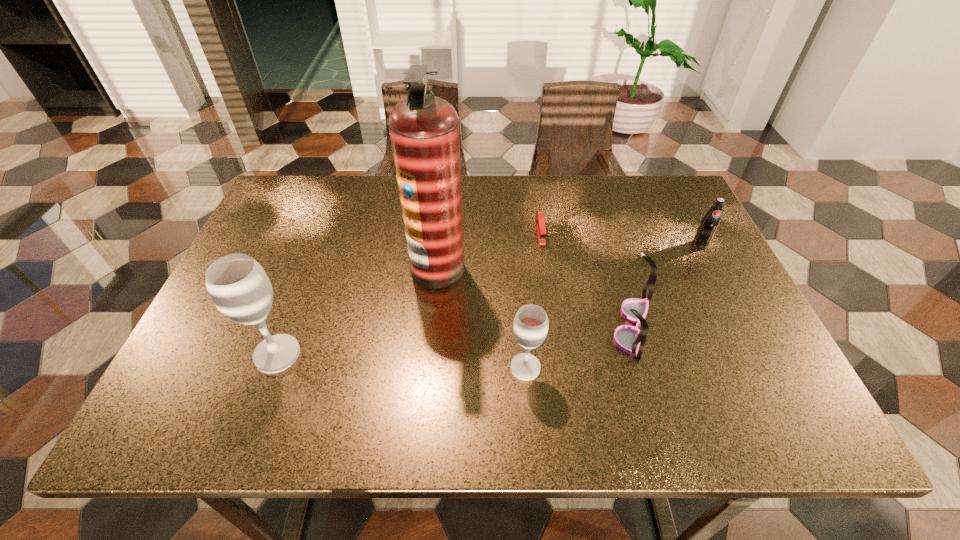
Where is `the taller wineglass`? The height and width of the screenshot is (540, 960). the taller wineglass is located at coordinates (239, 287).

Locate an element on the screen. Image resolution: width=960 pixels, height=540 pixels. the left wineglass is located at coordinates (239, 287).

Identify the location of the fourth object from right to left. The height and width of the screenshot is (540, 960). (530, 327).

Identify the location of the right wineglass. This screenshot has height=540, width=960. (530, 327).

This screenshot has width=960, height=540. I want to click on the fifth object from right to left, so click(424, 130).

In order to click on fire extinguisher in this screenshot , I will do `click(424, 130)`.

Image resolution: width=960 pixels, height=540 pixels. Identify the location of pop. (708, 226).

Where is `the shortest object`? This screenshot has width=960, height=540. the shortest object is located at coordinates (540, 221).

You are a GUI agent. You are given a task and a screenshot of the screen. Output one action in this format:
    pyautogui.click(x=<x>, y=<y>)
    Task: Click on the fourth object from left to right
    This screenshot has height=540, width=960.
    Given the screenshot: What is the action you would take?
    pyautogui.click(x=540, y=221)

Identify the location of the second object from right to left. (630, 339).